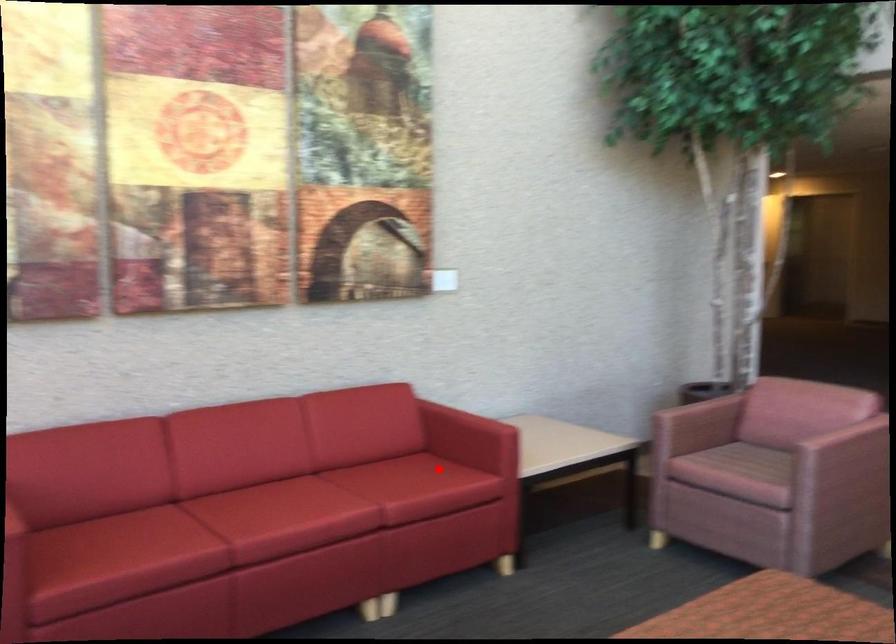
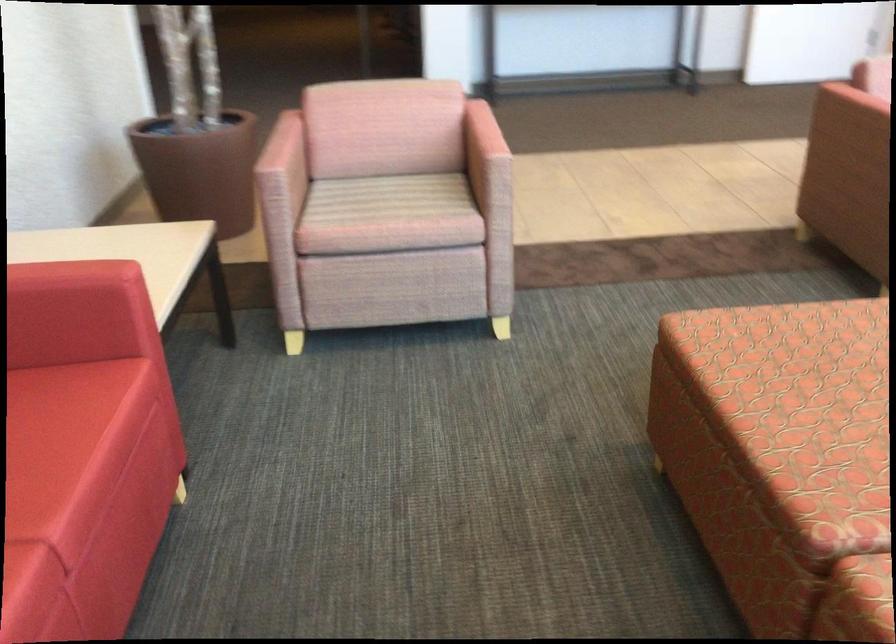
Question: I am providing you with two images of the same scene from different viewpoints. In image1, a red point is highlighted. Considering the same 3D point in image2, which of the following is correct?

Choices:
 (A) It is closer
 (B) It is farther

Answer: (A)